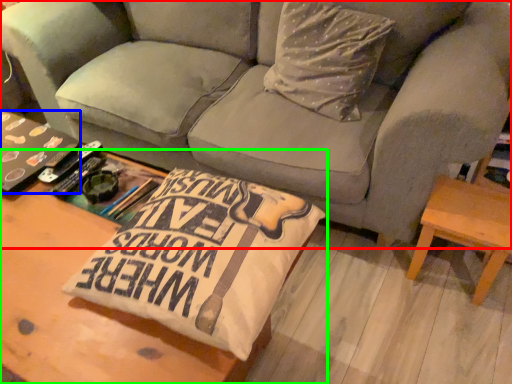
Question: Estimate the real-world distances between objects in this image. Which object is farther from studio couch (highlighted by a red box), book (highlighted by a blue box) or table (highlighted by a green box)?

Choices:
 (A) book
 (B) table

Answer: (B)